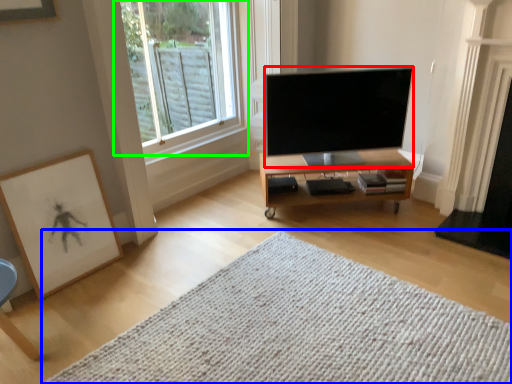
Question: Which object is the closest to the television (highlighted by a red box)? Choose among these: mat (highlighted by a blue box) or window (highlighted by a green box).

Choices:
 (A) mat
 (B) window

Answer: (B)